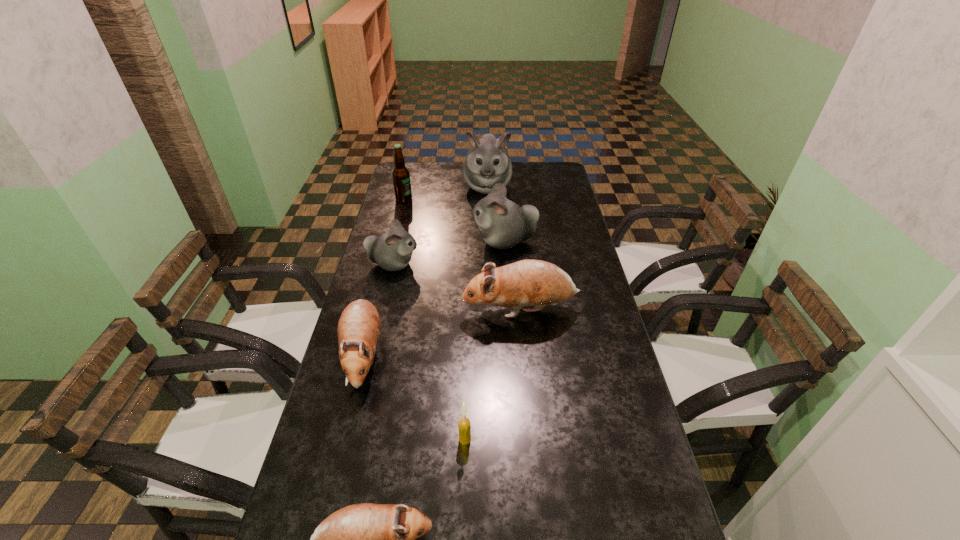
Identify the location of the farthest hamster. The width and height of the screenshot is (960, 540). (487, 163).

Locate an element on the screen. This screenshot has width=960, height=540. the tallest hamster is located at coordinates (487, 163).

I want to click on beer bottle, so click(x=401, y=176).

Where is `the second smallest white hamster`? This screenshot has height=540, width=960. the second smallest white hamster is located at coordinates (503, 224).

The image size is (960, 540). What are the coordinates of `the rightmost brown hamster` in the screenshot? It's located at coord(537,283).

The height and width of the screenshot is (540, 960). I want to click on the smallest white hamster, so click(x=392, y=251).

The image size is (960, 540). I want to click on the second smallest brown hamster, so click(359, 325).

Identify the location of the seventh farthest object. The height and width of the screenshot is (540, 960). (464, 426).

This screenshot has width=960, height=540. I want to click on candle, so click(x=464, y=426).

Locate an element on the screen. This screenshot has height=540, width=960. vacant space positioned on the face of the tallest hamster is located at coordinates (488, 211).